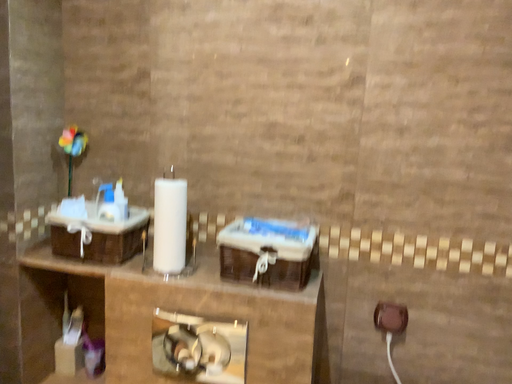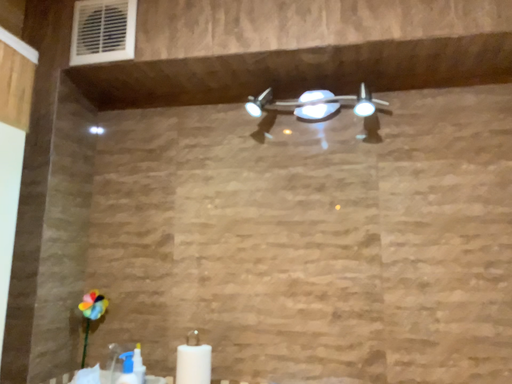
Question: Which way did the camera rotate in the video?

Choices:
 (A) rotated downward
 (B) rotated upward

Answer: (B)